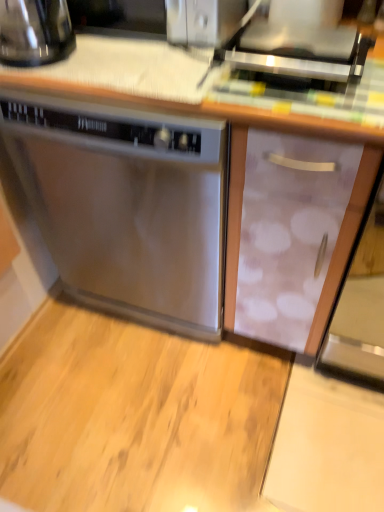
Locate an element on the screen. vacant space in shiny black kettle at upper left (from a real-world perspective) is located at coordinates (43, 60).